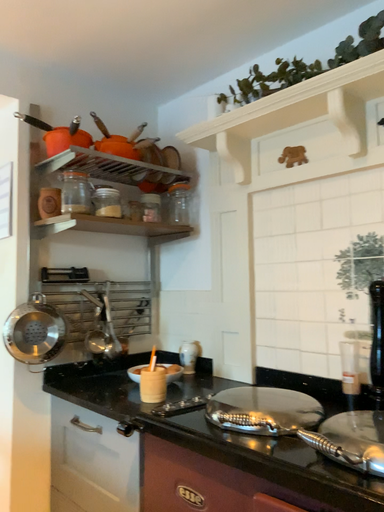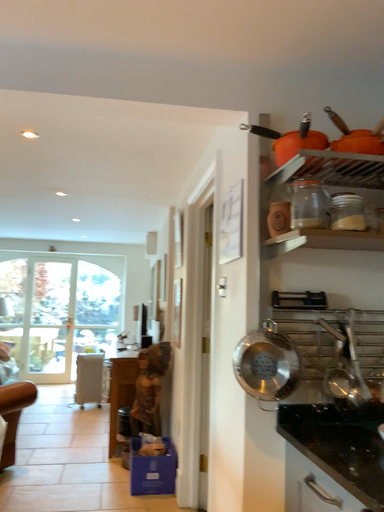
Question: How did the camera likely rotate when shooting the video?

Choices:
 (A) rotated left
 (B) rotated right

Answer: (A)